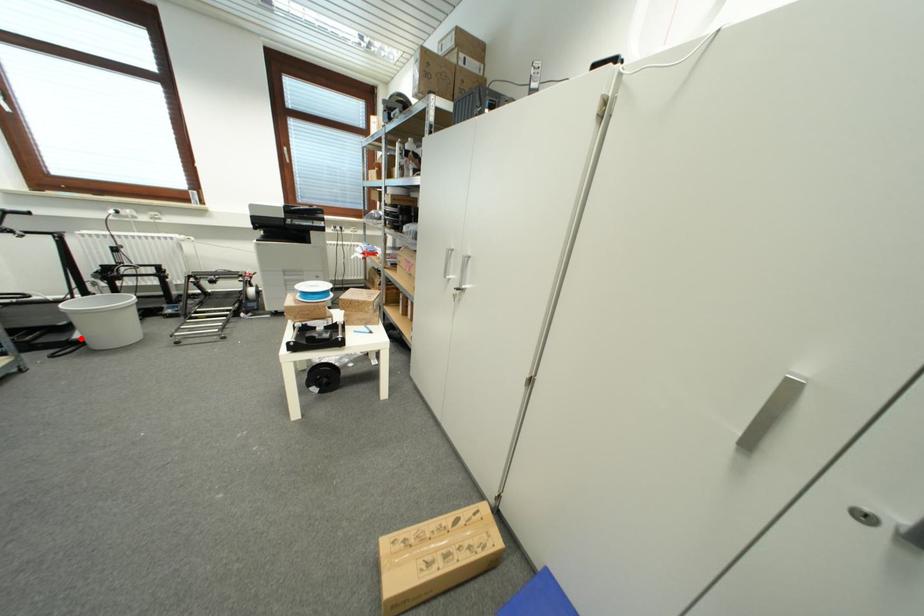
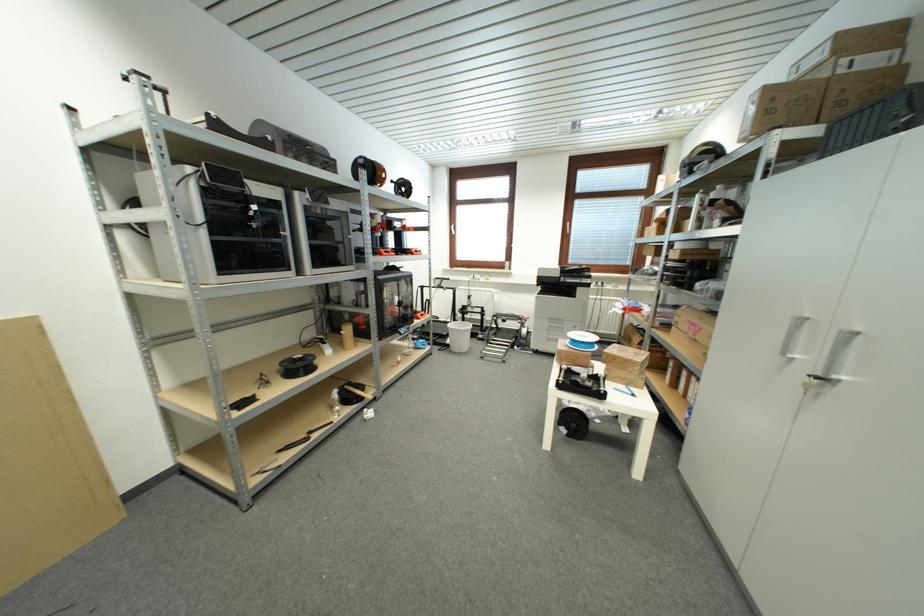
Where in the second image is the point corresponding to the highlighted location from the first image?

(453, 344)